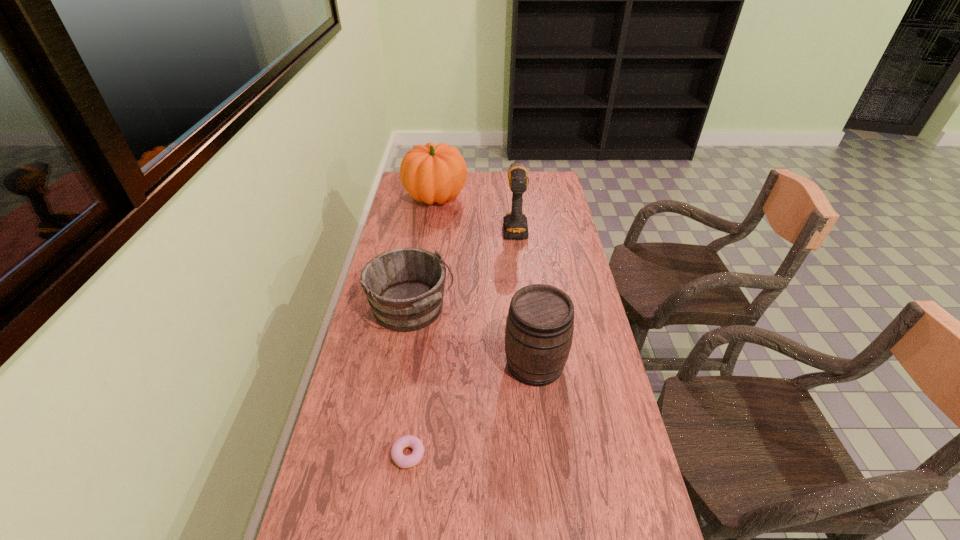
You are a GUI agent. You are given a task and a screenshot of the screen. Output one action in this format:
    pyautogui.click(x=<x>, y=<y>)
    Task: Click on the vacant space at the far edge of the desktop
    This screenshot has height=540, width=960.
    Given the screenshot: What is the action you would take?
    pyautogui.click(x=497, y=182)

Where is `blank space at the left edge of the desktop`? blank space at the left edge of the desktop is located at coordinates (407, 227).

Find the location of a particular element. free location at the right edge of the desktop is located at coordinates (583, 348).

Locate an element on the screen. vacant region between the pumpkin and the right wine bucket is located at coordinates [x=486, y=280].

Where is `vacant area between the drill and the nearest object`? The height and width of the screenshot is (540, 960). vacant area between the drill and the nearest object is located at coordinates (462, 341).

Locate an element on the screen. The height and width of the screenshot is (540, 960). free space that is in between the taller wine bucket and the pumpkin is located at coordinates (486, 280).

In order to click on free area in between the drill and the doughnut in this screenshot , I will do `click(462, 341)`.

This screenshot has height=540, width=960. Find the location of `vacant space that is in between the taller wine bucket and the shorter wine bucket`. vacant space that is in between the taller wine bucket and the shorter wine bucket is located at coordinates (473, 336).

Where is `vacant space that's between the pumpkin and the drill`? This screenshot has width=960, height=540. vacant space that's between the pumpkin and the drill is located at coordinates (475, 212).

Where is `object identified as the closest to the shortest object`? The height and width of the screenshot is (540, 960). object identified as the closest to the shortest object is located at coordinates tap(539, 329).